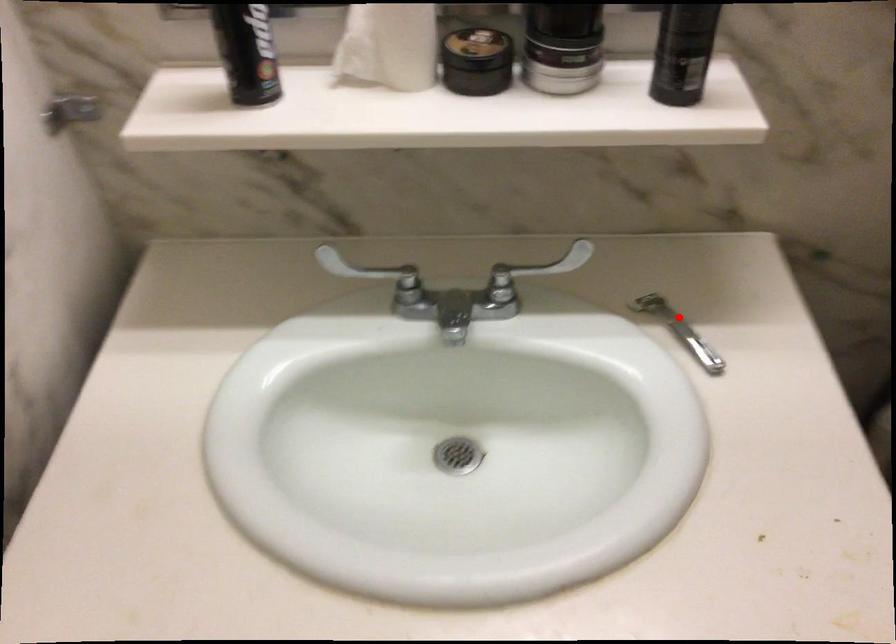
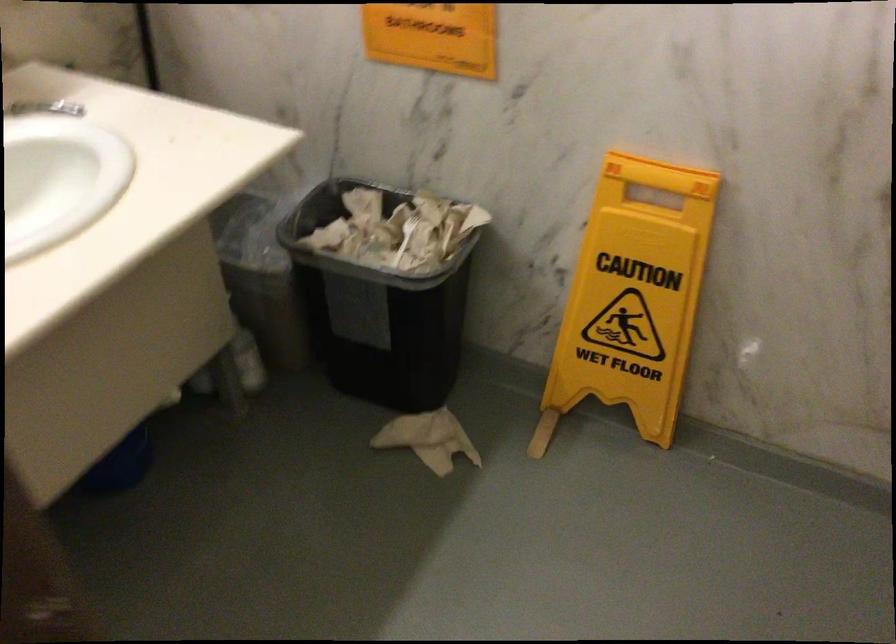
Find the pixel in the second image that matches the highlighted location in the first image.

(45, 108)